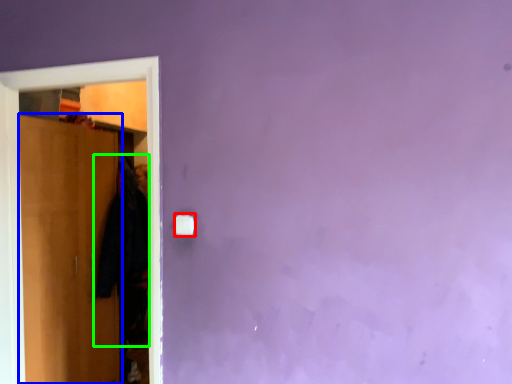
Question: Based on their relative distances, which object is nearer to light switch (highlighted by a red box)? Choose from door (highlighted by a blue box) and clothing (highlighted by a green box).

Choices:
 (A) door
 (B) clothing

Answer: (A)